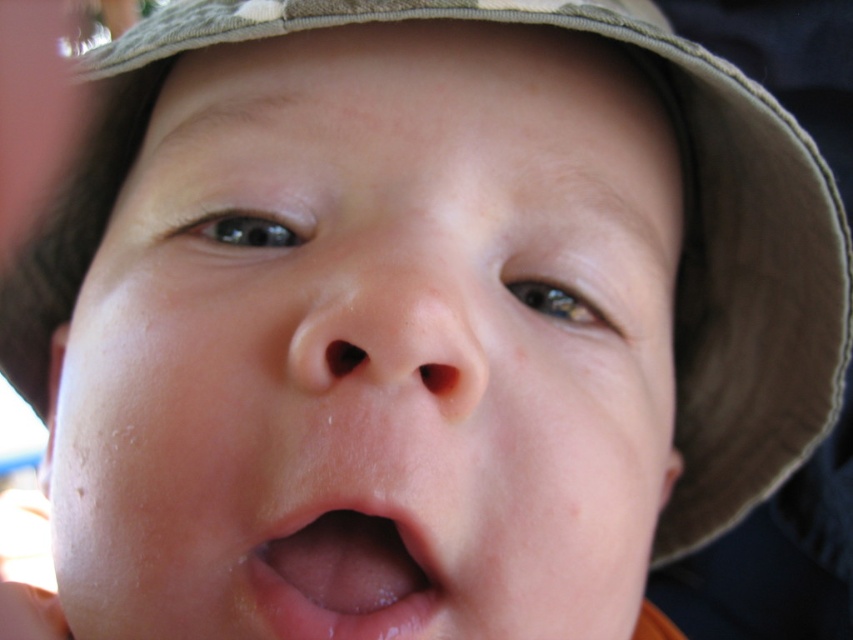
What are the coordinates of the smooth skin face at center?

The smooth skin face at center is located at coordinates point (374, 346).

Based on the scene description, which object has a greater width when comparing the smooth skin face at center and the pink smooth lips at center?

The smooth skin face at center has a greater width than the pink smooth lips at center according to the description.